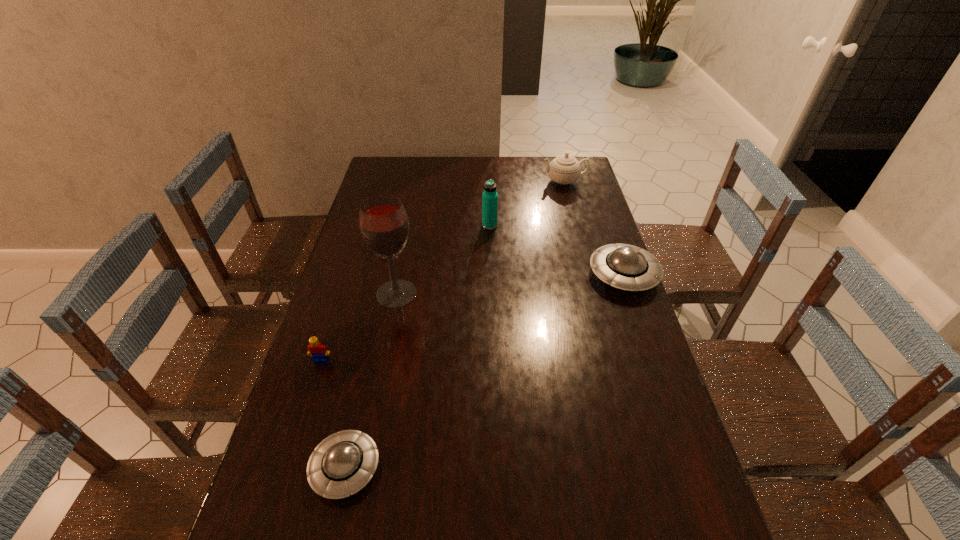
Find the location of `the fifth farthest object`. the fifth farthest object is located at coordinates (319, 352).

You are a GUI agent. You are given a task and a screenshot of the screen. Output one action in this format:
    pyautogui.click(x=<x>, y=<y>)
    Task: Click on the free space located on the right of the left saucer
    This screenshot has width=960, height=540.
    Given the screenshot: What is the action you would take?
    pyautogui.click(x=448, y=468)

At what (x,y) coordinates should I click in order to perform the action: click on vacant region located on the left of the farther saucer. Please return your answer as a coordinate pair (x, y). The height and width of the screenshot is (540, 960). Looking at the image, I should click on (558, 275).

I want to click on vacant space located 0.370m on the spout of the fourth shortest object, so click(x=453, y=181).

Identify the location of vacant space located on the spout of the fourth shortest object. (525, 181).

Where is `free location located 0.230m on the spout of the fourth shortest object`? This screenshot has height=540, width=960. free location located 0.230m on the spout of the fourth shortest object is located at coordinates (487, 181).

Locate an element on the screen. vacant space situated on the left of the fifth nearest object is located at coordinates coord(466,226).

This screenshot has height=540, width=960. Find the location of `vacant area situated 0.390m on the front of the tallest object`. vacant area situated 0.390m on the front of the tallest object is located at coordinates (370, 433).

Image resolution: width=960 pixels, height=540 pixels. I want to click on vacant space located 0.280m on the front-facing side of the fifth farthest object, so click(286, 470).

At what (x,y) coordinates should I click in order to perform the action: click on object that is at the far edge. Please return your answer as a coordinate pair (x, y). Looking at the image, I should click on (564, 169).